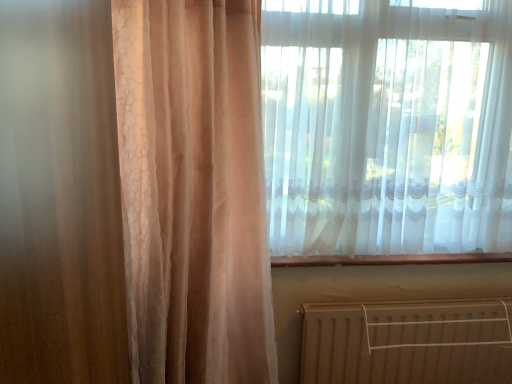
Question: Is brown metallic radiator at lower right located within white sheer curtain at upper right?

Choices:
 (A) no
 (B) yes

Answer: (A)

Question: Considering the relative positions of white sheer curtain at upper right and brown metallic radiator at lower right in the image provided, is white sheer curtain at upper right to the right of brown metallic radiator at lower right from the viewer's perspective?

Choices:
 (A) no
 (B) yes

Answer: (A)

Question: Is white sheer curtain at upper right placed right next to brown metallic radiator at lower right?

Choices:
 (A) no
 (B) yes

Answer: (A)

Question: From a real-world perspective, does white sheer curtain at upper right stand above brown metallic radiator at lower right?

Choices:
 (A) no
 (B) yes

Answer: (B)

Question: From the image's perspective, is white sheer curtain at upper right above brown metallic radiator at lower right?

Choices:
 (A) no
 (B) yes

Answer: (B)

Question: From the image's perspective, is white sheer curtain at upper right beneath brown metallic radiator at lower right?

Choices:
 (A) no
 (B) yes

Answer: (A)

Question: Does brown metallic radiator at lower right appear on the right side of white sheer curtain at upper right?

Choices:
 (A) yes
 (B) no

Answer: (A)

Question: From a real-world perspective, is brown metallic radiator at lower right under white sheer curtain at upper right?

Choices:
 (A) yes
 (B) no

Answer: (A)

Question: Would you say brown metallic radiator at lower right is outside white sheer curtain at upper right?

Choices:
 (A) yes
 (B) no

Answer: (A)

Question: Is brown metallic radiator at lower right wider than white sheer curtain at upper right?

Choices:
 (A) yes
 (B) no

Answer: (B)

Question: Does brown metallic radiator at lower right have a greater height compared to white sheer curtain at upper right?

Choices:
 (A) no
 (B) yes

Answer: (A)

Question: Is brown metallic radiator at lower right looking in the opposite direction of white sheer curtain at upper right?

Choices:
 (A) no
 (B) yes

Answer: (A)

Question: Do you think white sheer curtain at upper right is within brown metallic radiator at lower right, or outside of it?

Choices:
 (A) inside
 (B) outside

Answer: (B)